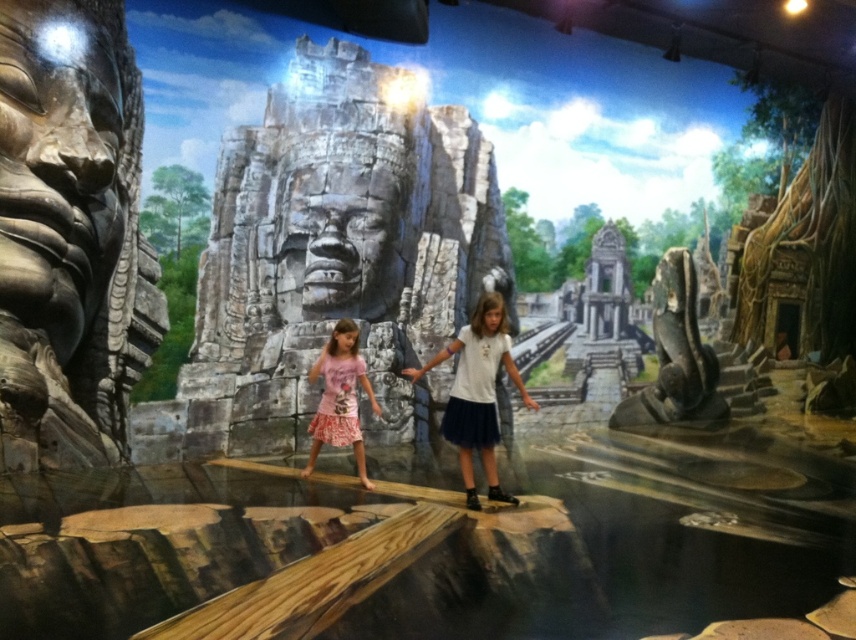
Question: Among these objects, which one is farthest from the camera?

Choices:
 (A) bronze stone face at left
 (B) pink floral dress at center
 (C) gray stone face at center

Answer: (C)

Question: From the image, what is the correct spatial relationship of rusty stone statue at right in relation to white tulle skirt at center?

Choices:
 (A) left
 (B) right

Answer: (B)

Question: Does rusty stone statue at right appear under white tulle skirt at center?

Choices:
 (A) no
 (B) yes

Answer: (A)

Question: Among these objects, which one is farthest from the camera?

Choices:
 (A) gray stone face at center
 (B) bronze stone face at left
 (C) rusty stone statue at right

Answer: (C)

Question: In this image, where is white tulle skirt at center located relative to pink floral dress at center?

Choices:
 (A) right
 (B) left

Answer: (A)

Question: Which point is farther to the camera?

Choices:
 (A) pink floral dress at center
 (B) gray stone face at center

Answer: (B)